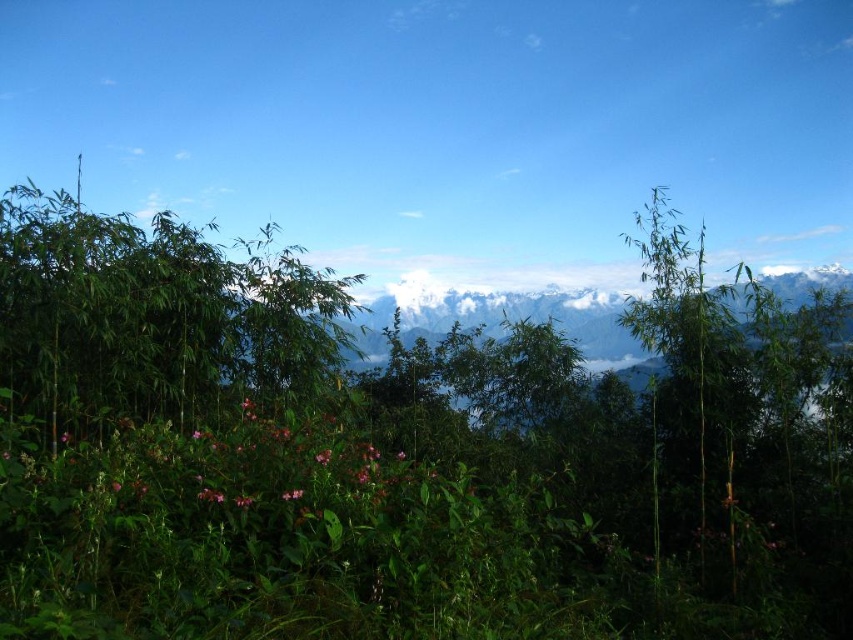
Question: Which object is the closest to the pink matte flowers at lower left?

Choices:
 (A) green bamboo at left
 (B) pink matte flower at lower left
 (C) pink matte flower at center

Answer: (C)

Question: Considering the relative positions of green bamboo at left and pink matte flowers at lower left in the image provided, where is green bamboo at left located with respect to pink matte flowers at lower left?

Choices:
 (A) left
 (B) right

Answer: (A)

Question: Is green bamboo at left bigger than pink matte flowers at lower left?

Choices:
 (A) yes
 (B) no

Answer: (A)

Question: Which of these objects is positioned farthest from the pink matte flowers at lower left?

Choices:
 (A) pink matte flower at center
 (B) green bamboo at left
 (C) pink matte flower at lower left

Answer: (C)

Question: Is pink matte flowers at lower left positioned in front of pink matte flower at lower left?

Choices:
 (A) yes
 (B) no

Answer: (A)

Question: Which point is farther from the camera taking this photo?

Choices:
 (A) (320, 307)
 (B) (286, 481)

Answer: (A)